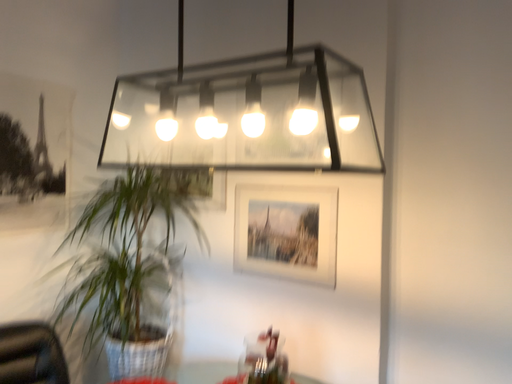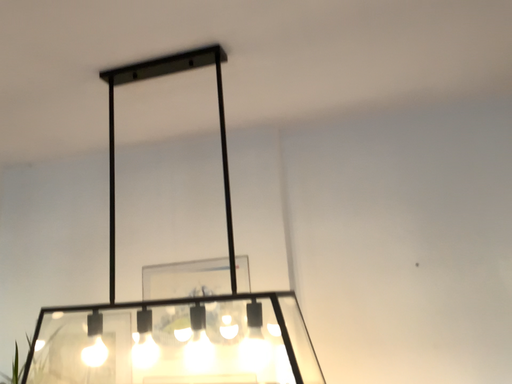
Question: How did the camera likely rotate when shooting the video?

Choices:
 (A) rotated left
 (B) rotated right

Answer: (B)